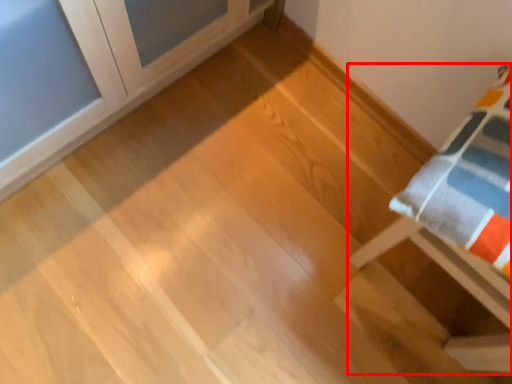
Question: Observing the image, what is the correct spatial positioning of furniture (annotated by the red box) in reference to furniture?

Choices:
 (A) right
 (B) left

Answer: (A)